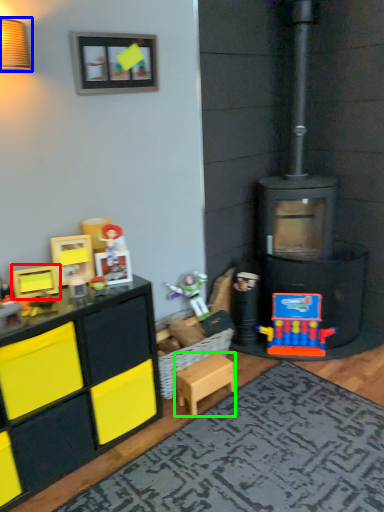
Question: Estimate the real-world distances between objects in this image. Which object is closer to toy (highlighted by a red box), lamp (highlighted by a blue box) or toy (highlighted by a green box)?

Choices:
 (A) lamp
 (B) toy

Answer: (B)